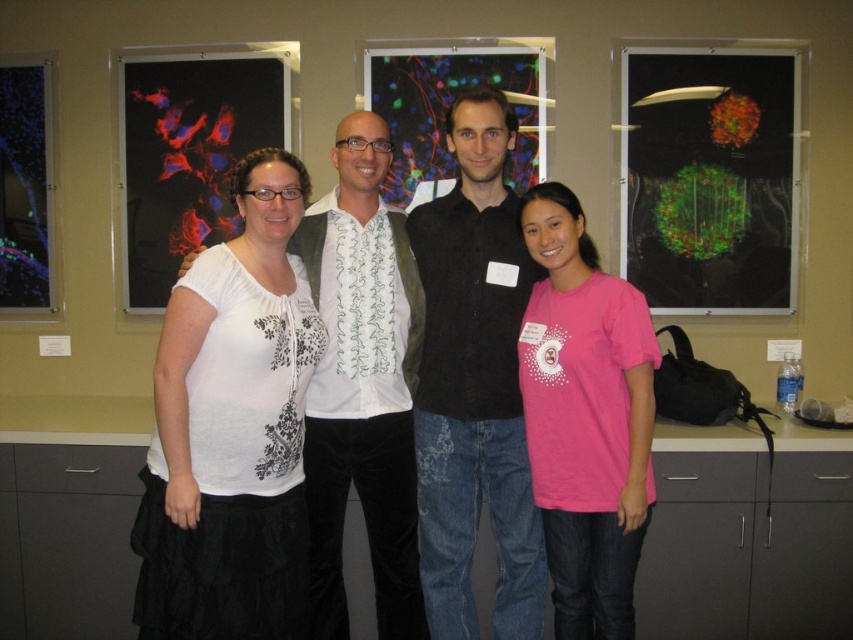
Question: Is white lace blouse at center above black matte shirt at center?

Choices:
 (A) yes
 (B) no

Answer: (B)

Question: Which of the following is the farthest from the observer?

Choices:
 (A) pink fabric shirt at center
 (B) white printed shirt at center

Answer: (B)

Question: Which point is closer to the camera?

Choices:
 (A) (167, 426)
 (B) (312, 291)

Answer: (A)

Question: Does black matte shirt at center lie in front of white printed shirt at center?

Choices:
 (A) no
 (B) yes

Answer: (B)

Question: Can you confirm if white printed shirt at center is smaller than pink fabric shirt at center?

Choices:
 (A) no
 (B) yes

Answer: (A)

Question: Which point is farther to the camera?

Choices:
 (A) white printed shirt at center
 (B) black matte shirt at center

Answer: (A)